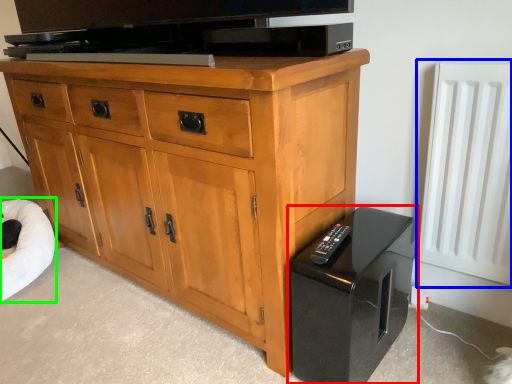
Question: Which object is positioned farthest from home appliance (highlighted by a red box)? Select from radiator (highlighted by a blue box) and bean bag chair (highlighted by a green box).

Choices:
 (A) radiator
 (B) bean bag chair

Answer: (B)